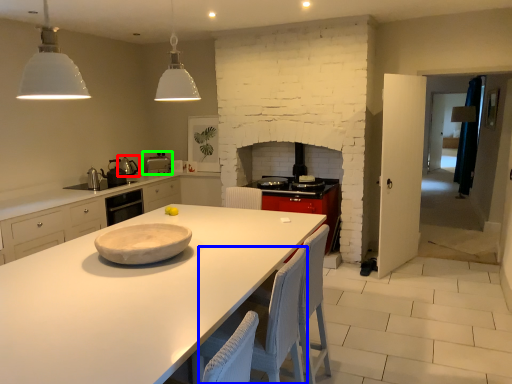
Question: Which object is the closest to the appliance (highlighted by a red box)? Choose among these: chair (highlighted by a blue box) or appliance (highlighted by a green box).

Choices:
 (A) chair
 (B) appliance

Answer: (B)